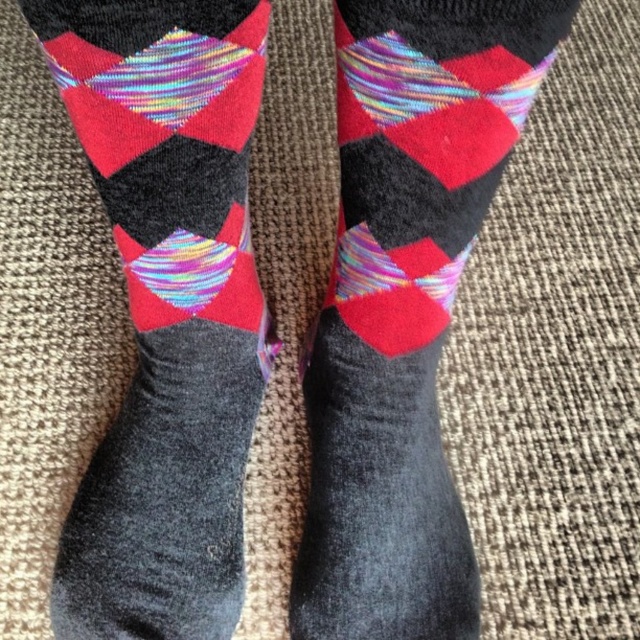
Is textured wool socks at center taller than holographic fabric socks at center?

Incorrect, textured wool socks at center's height is not larger of holographic fabric socks at center's.

Who is more forward, [152,524] or [566,1]?

Point [566,1] is in front.

Where is `textured wool socks at center`? textured wool socks at center is located at coordinates (166, 308).